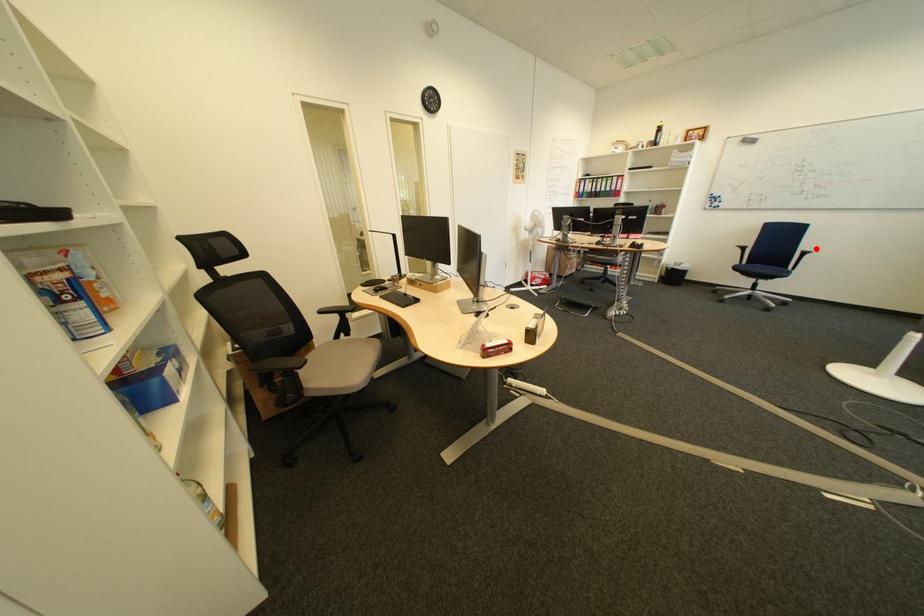
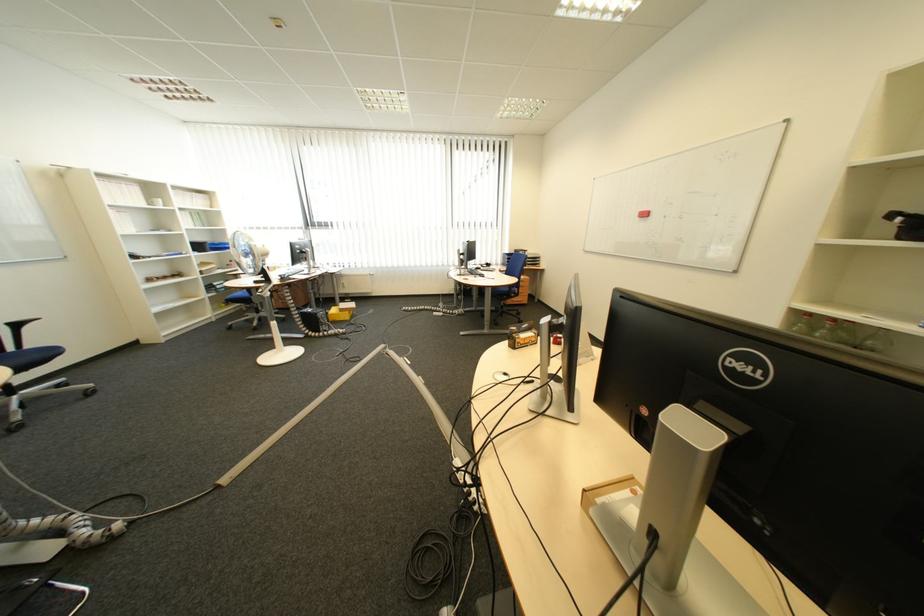
Where in the second image is the point corresponding to the highlighted location from the first image?

(13, 321)